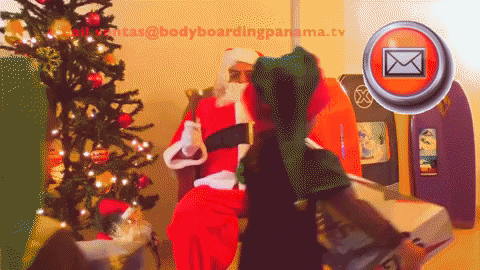
At what (x,y) coordinates should I click in order to perform the action: click on chair. Please return your answer as a coordinate pair (x, y). The image size is (480, 270). Looking at the image, I should click on (121, 144).